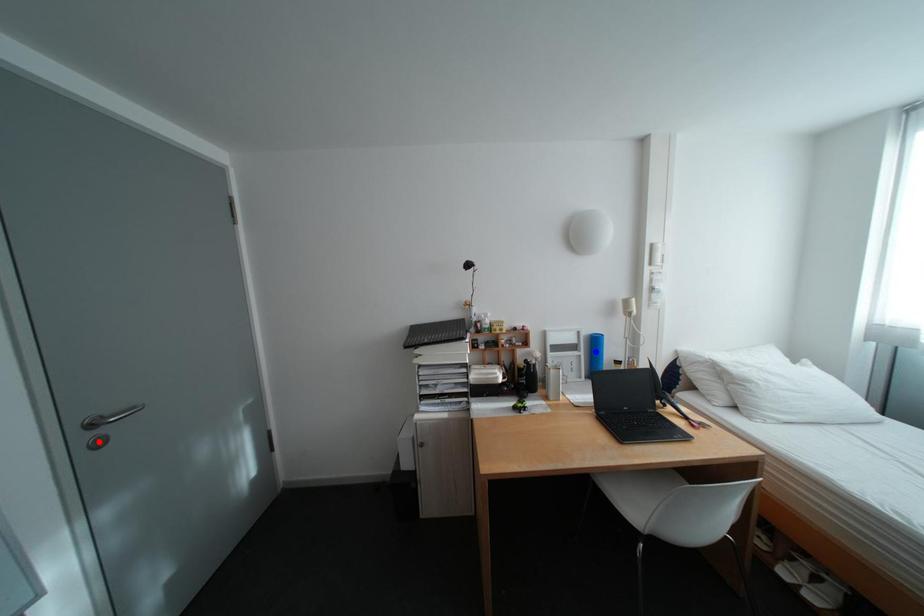
Question: Which of the two points in the image is closer to the camera?

Choices:
 (A) Blue point is closer.
 (B) Red point is closer.

Answer: (B)